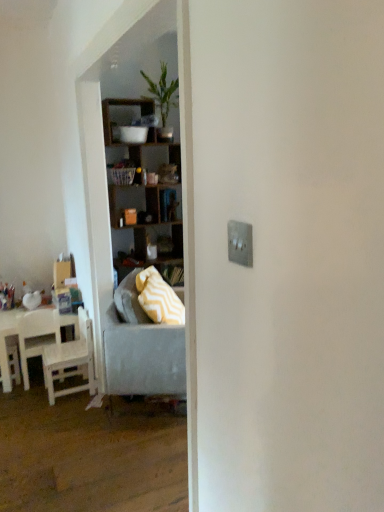
Measure the distance between silver metallic light switch at upper right and camera.

silver metallic light switch at upper right is 34.02 inches from camera.

This screenshot has height=512, width=384. Find the location of `matte cardboard box at left`. matte cardboard box at left is located at coordinates (63, 270).

Identify the location of green leafy plant at upper center. (162, 91).

Find the location of a particular element. silver metallic light switch at upper right is located at coordinates tap(240, 243).

Considering their positions, is wooden shelves at center located in front of or behind white matte chair at left, acting as the second chair starting from the right?

Visually, wooden shelves at center is located behind white matte chair at left, acting as the second chair starting from the right.

Which object is wider, wooden shelves at center or white matte chair at left, which ranks as the first chair in left-to-right order?

With larger width is wooden shelves at center.

Would you say wooden shelves at center is outside white matte chair at left, acting as the second chair starting from the right?

Yes, wooden shelves at center is located beyond the bounds of white matte chair at left, acting as the second chair starting from the right.

Are wooden shelves at center and white matte chair at left, acting as the second chair starting from the right, located far from each other?

That's right, there is a large distance between wooden shelves at center and white matte chair at left, acting as the second chair starting from the right.

Considering the relative sizes of yellow zigzag fabric pillow at center and plastic picnic basket at center in the image provided, is yellow zigzag fabric pillow at center wider than plastic picnic basket at center?

Yes, yellow zigzag fabric pillow at center is wider than plastic picnic basket at center.

Could you tell me if yellow zigzag fabric pillow at center is turned towards plastic picnic basket at center?

No.

Between point (143, 308) and point (110, 174), which one is positioned behind?

The point (110, 174) is behind.

Which object is further away from the camera, yellow zigzag fabric pillow at center or plastic picnic basket at center?

Positioned behind is plastic picnic basket at center.

Does white matte chair at left, acting as the second chair starting from the right, turn towards green leafy plant at upper center?

No, white matte chair at left, acting as the second chair starting from the right, does not turn towards green leafy plant at upper center.

From the image's perspective, is white matte chair at left, which ranks as the first chair in left-to-right order, positioned above or below green leafy plant at upper center?

Based on their image positions, white matte chair at left, which ranks as the first chair in left-to-right order, is located beneath green leafy plant at upper center.

Which of these two, white matte chair at left, acting as the second chair starting from the right, or green leafy plant at upper center, stands shorter?

white matte chair at left, acting as the second chair starting from the right, is shorter.

Considering the relative positions of white matte chair at left, which ranks as the first chair in left-to-right order, and green leafy plant at upper center in the image provided, is white matte chair at left, which ranks as the first chair in left-to-right order, to the left or to the right of green leafy plant at upper center?

Clearly, white matte chair at left, which ranks as the first chair in left-to-right order, is on the left of green leafy plant at upper center in the image.

Image resolution: width=384 pixels, height=512 pixels. In order to click on chair that appears below the white matte chair at left, acting as the second chair starting from the right (from a real-world perspective) in this screenshot , I will do `click(71, 361)`.

Is point (38, 317) closer or farther from the camera than point (86, 372)?

Point (38, 317) appears to be closer to the viewer than point (86, 372).

How much distance is there between white matte chair at left, which ranks as the first chair in left-to-right order, and white wood chair at left, marked as the first chair in a right-to-left arrangement?

8.60 inches.

Consider the image. Considering the relative sizes of white matte chair at left, acting as the second chair starting from the right, and white wood chair at left, the second chair viewed from the left, in the image provided, is white matte chair at left, acting as the second chair starting from the right, wider than white wood chair at left, the second chair viewed from the left,?

Incorrect, the width of white matte chair at left, acting as the second chair starting from the right, does not surpass that of white wood chair at left, the second chair viewed from the left.

Is plastic picnic basket at center positioned with its back to green leafy plant at upper center?

No.

Based on the photo, how different are the orientations of plastic picnic basket at center and green leafy plant at upper center in degrees?

plastic picnic basket at center and green leafy plant at upper center are facing 0.731 degrees away from each other.

Is plastic picnic basket at center far from green leafy plant at upper center?

No, there isn't a large distance between plastic picnic basket at center and green leafy plant at upper center.

Is plastic picnic basket at center outside of green leafy plant at upper center?

Yes, plastic picnic basket at center is outside of green leafy plant at upper center.

Which is in front, point (164, 230) or point (118, 345)?

The point (118, 345) is closer to the camera.

Is wooden shelves at center located outside gray fabric couch at center?

Yes.

Identify the location of studio couch below the wooden shelves at center (from the image's perspective). This screenshot has height=512, width=384. (141, 349).

Considering the sizes of objects wooden shelves at center and gray fabric couch at center in the image provided, who is bigger, wooden shelves at center or gray fabric couch at center?

wooden shelves at center.

Based on the photo, is white wood chair at left, marked as the first chair in a right-to-left arrangement, not near silver metallic light switch at upper right?

white wood chair at left, marked as the first chair in a right-to-left arrangement, is far away from silver metallic light switch at upper right.

Identify the location of light switch lying above the white wood chair at left, marked as the first chair in a right-to-left arrangement (from the image's perspective). The width and height of the screenshot is (384, 512). (240, 243).

How different are the orientations of white wood chair at left, marked as the first chair in a right-to-left arrangement, and silver metallic light switch at upper right in degrees?

The angle between the facing direction of white wood chair at left, marked as the first chair in a right-to-left arrangement, and the facing direction of silver metallic light switch at upper right is 0.0132 degrees.

Considering their positions, is white wood chair at left, marked as the first chair in a right-to-left arrangement, located in front of or behind silver metallic light switch at upper right?

white wood chair at left, marked as the first chair in a right-to-left arrangement, is behind silver metallic light switch at upper right.

Find the location of a particular element. This screenshot has height=512, width=384. shelf on the right of white matte chair at left, acting as the second chair starting from the right is located at coordinates (144, 192).

The image size is (384, 512). In the image, there is a yellow zigzag fabric pillow at center. What are the coordinates of `picnic basket above it (from the image's perspective)` in the screenshot? It's located at (122, 175).

Considering their positions, is yellow zigzag fabric pillow at center positioned closer to white matte chair at left, acting as the second chair starting from the right, than plastic picnic basket at center?

yellow zigzag fabric pillow at center is positioned closer to the anchor white matte chair at left, acting as the second chair starting from the right.

Based on their spatial positions, is silver metallic light switch at upper right or white matte chair at left, acting as the second chair starting from the right, closer to gray fabric couch at center?

white matte chair at left, acting as the second chair starting from the right.

Based on their spatial positions, is yellow zigzag fabric pillow at center or silver metallic light switch at upper right closer to white matte chair at left, which ranks as the first chair in left-to-right order?

The object closer to white matte chair at left, which ranks as the first chair in left-to-right order, is yellow zigzag fabric pillow at center.

Estimate the real-world distances between objects in this image. Which object is closer to wooden shelves at center, white wood chair at left, marked as the first chair in a right-to-left arrangement, or green leafy plant at upper center?

green leafy plant at upper center is positioned closer to the anchor wooden shelves at center.

Based on their spatial positions, is plastic picnic basket at center or matte cardboard box at left closer to wooden shelves at center?

plastic picnic basket at center lies closer to wooden shelves at center than the other object.

Considering their positions, is matte cardboard box at left positioned further to gray fabric couch at center than silver metallic light switch at upper right?

The object further to gray fabric couch at center is silver metallic light switch at upper right.

From the image, which object appears to be nearer to wooden shelves at center, gray fabric couch at center or silver metallic light switch at upper right?

gray fabric couch at center lies closer to wooden shelves at center than the other object.

Looking at this image, based on their spatial positions, is green leafy plant at upper center or white matte chair at left, acting as the second chair starting from the right, closer to yellow zigzag fabric pillow at center?

white matte chair at left, acting as the second chair starting from the right, lies closer to yellow zigzag fabric pillow at center than the other object.

At what (x,y) coordinates should I click in order to perform the action: click on box between green leafy plant at upper center and white wood chair at left, marked as the first chair in a right-to-left arrangement, in the vertical direction. Please return your answer as a coordinate pair (x, y). Looking at the image, I should click on (63, 270).

Find the location of `box that lies between green leafy plant at upper center and gray fabric couch at center from top to bottom`. box that lies between green leafy plant at upper center and gray fabric couch at center from top to bottom is located at coordinates (63, 270).

The image size is (384, 512). Identify the location of chair between green leafy plant at upper center and white wood chair at left, marked as the first chair in a right-to-left arrangement, in the vertical direction. (36, 336).

Image resolution: width=384 pixels, height=512 pixels. I want to click on studio couch between wooden shelves at center and white wood chair at left, marked as the first chair in a right-to-left arrangement, from top to bottom, so click(x=141, y=349).